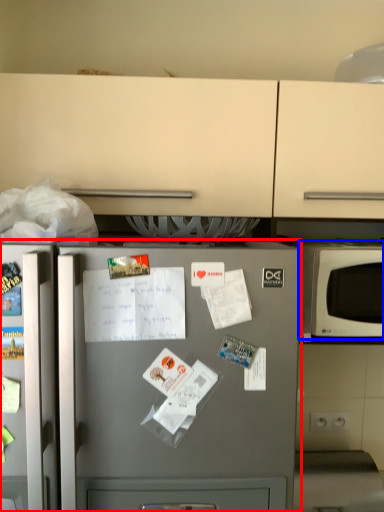
Question: Which point is further to the camera, refrigerator (highlighted by a red box) or microwave oven (highlighted by a blue box)?

Choices:
 (A) refrigerator
 (B) microwave oven

Answer: (B)